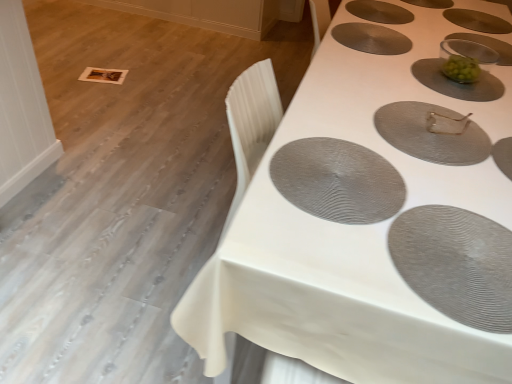
Locate an element on the screen. free space to the back side of textured gray oval at center, placed as the second oval when sorted from front to back is located at coordinates (332, 111).